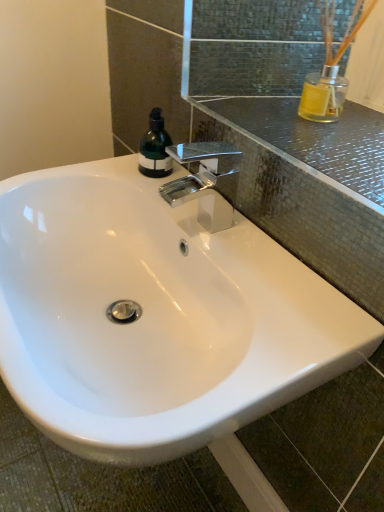
Question: In the image, is white glossy sink at center on the left side or the right side of green matte bottle at upper left?

Choices:
 (A) left
 (B) right

Answer: (A)

Question: From a real-world perspective, relative to green matte bottle at upper left, is white glossy sink at center vertically above or below?

Choices:
 (A) above
 (B) below

Answer: (B)

Question: Which object is positioned closest to the polished chrome faucet at upper center?

Choices:
 (A) green matte bottle at upper left
 (B) transparent glass mirror at upper center
 (C) white glossy sink at center

Answer: (A)

Question: Based on their relative distances, which object is farther from the polished chrome faucet at upper center?

Choices:
 (A) green matte bottle at upper left
 (B) transparent glass mirror at upper center
 (C) white glossy sink at center

Answer: (C)